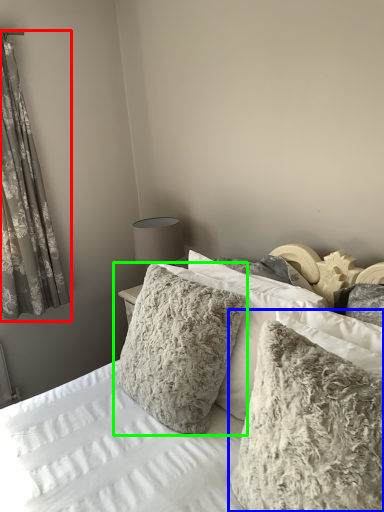
Question: Considering the real-world distances, which object is farthest from curtain (highlighted by a red box)? pillow (highlighted by a blue box) or pillow (highlighted by a green box)?

Choices:
 (A) pillow
 (B) pillow

Answer: (A)